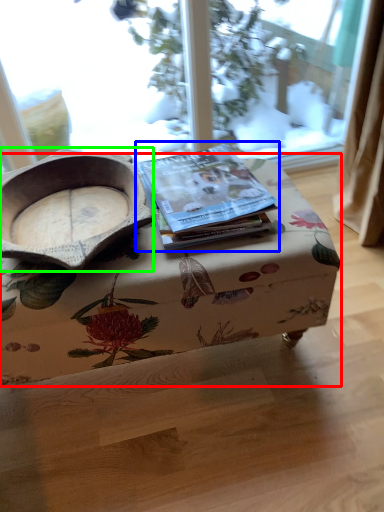
Question: Which object is positioned farthest from table (highlighted by a red box)? Select from paperback book (highlighted by a blue box) and bowl (highlighted by a green box).

Choices:
 (A) paperback book
 (B) bowl

Answer: (B)